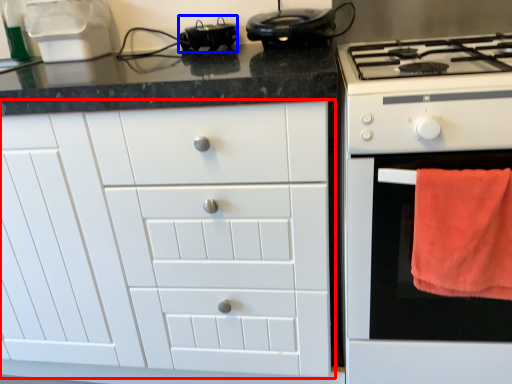
Question: Among these objects, which one is farthest to the camera, cabinetry (highlighted by a red box) or appliance (highlighted by a blue box)?

Choices:
 (A) cabinetry
 (B) appliance

Answer: (B)